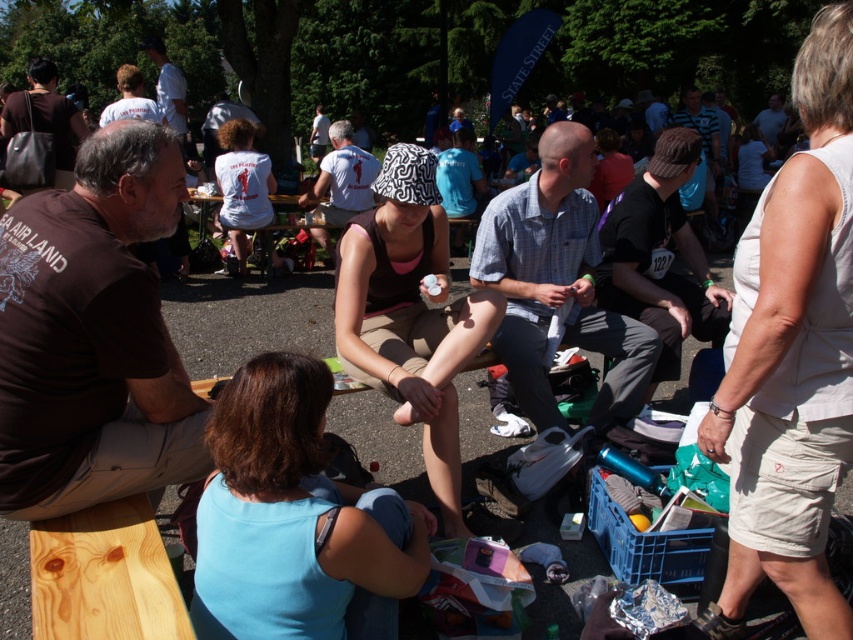
Question: Among these points, which one is nearest to the camera?

Choices:
 (A) (625, 360)
 (B) (606, 298)
 (C) (76, 148)
 (D) (312, 216)

Answer: (A)

Question: Among these objects, which one is farthest from the camera?

Choices:
 (A) matte brown shirt at left
 (B) white printed t-shirt at center
 (C) brown cotton t-shirt at left

Answer: (B)

Question: Is matte brown shirt at left to the right of white printed t-shirt at center from the viewer's perspective?

Choices:
 (A) no
 (B) yes

Answer: (A)

Question: Which object appears closest to the camera in this image?

Choices:
 (A) light blue plaid shirt at center
 (B) black cotton shirt at center
 (C) white printed t-shirt at center

Answer: (A)

Question: Is black cotton shirt at center smaller than white printed t-shirt at center?

Choices:
 (A) yes
 (B) no

Answer: (A)

Question: Does light blue plaid shirt at center appear under white cotton t-shirt at upper left?

Choices:
 (A) no
 (B) yes

Answer: (B)